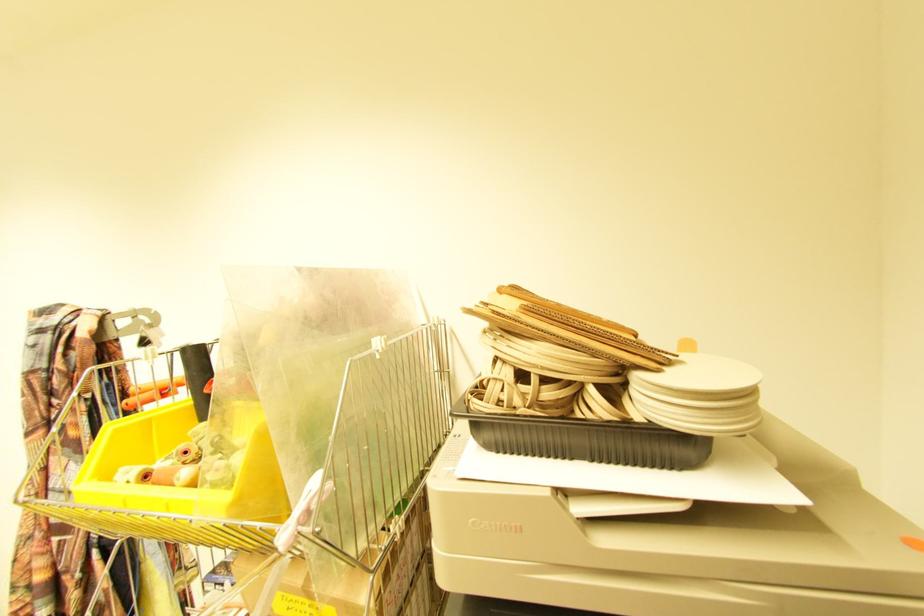
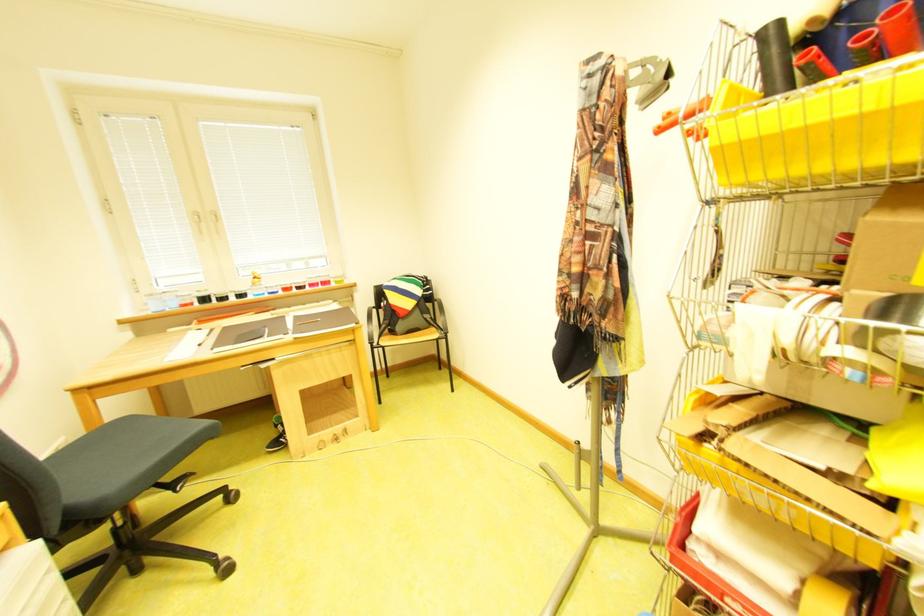
Question: The first image is from the beginning of the video and the second image is from the end. How did the camera likely rotate when shooting the video?

Choices:
 (A) Left
 (B) Right
 (C) Up
 (D) Down

Answer: (A)